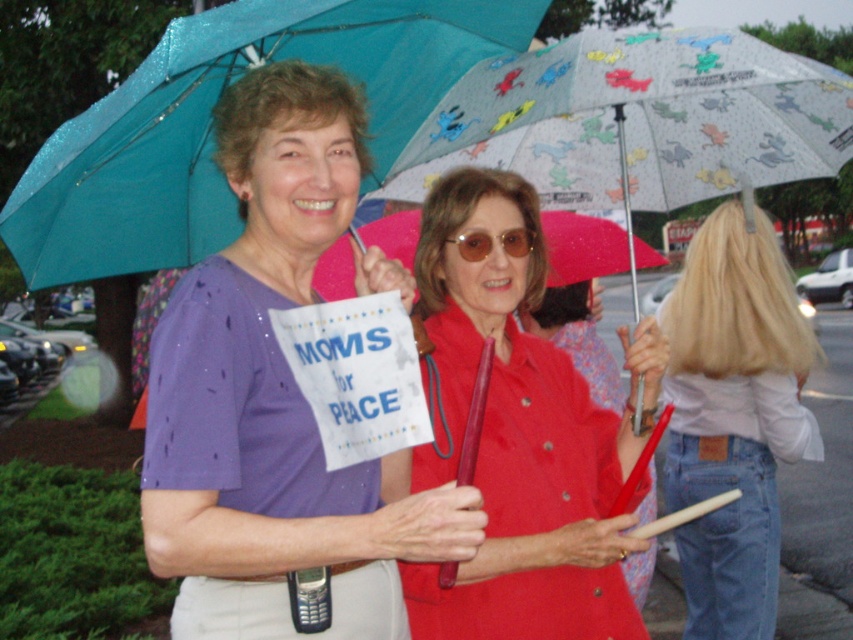
You are a photographer trying to capture a clear shot of both the blonde hair at upper right and the sunglassesmatte at center. Given their sizes, which object should you focus on first to ensure it fits within your camera frame?

The blonde hair at upper right is larger in size than the sunglassesmatte at center, so you should focus on capturing the blonde hair at upper right first to ensure it fits within the camera frame before adjusting for the smaller sunglassesmatte at center.